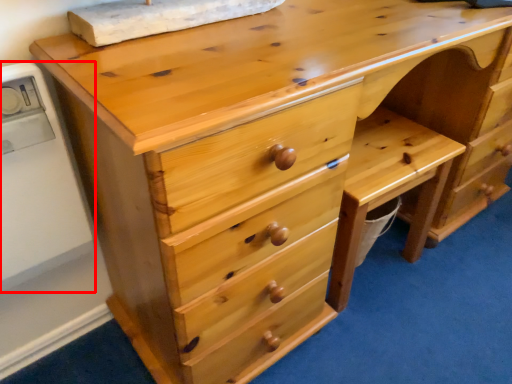
Question: From the image's perspective, where is appliance (annotated by the red box) located in relation to cabinetry in the image?

Choices:
 (A) above
 (B) below

Answer: (A)